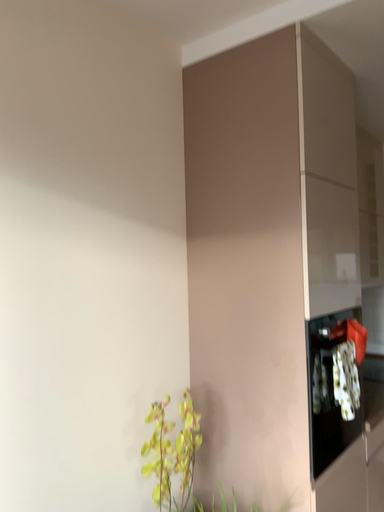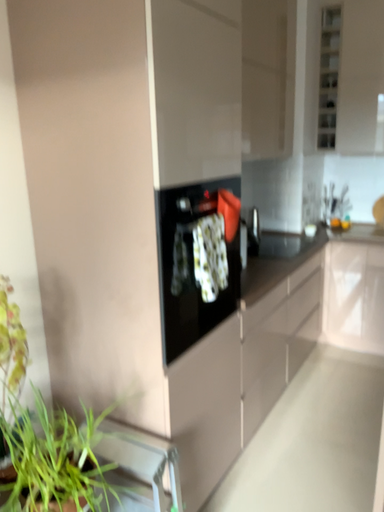
Question: How did the camera likely rotate when shooting the video?

Choices:
 (A) rotated left
 (B) rotated right

Answer: (B)